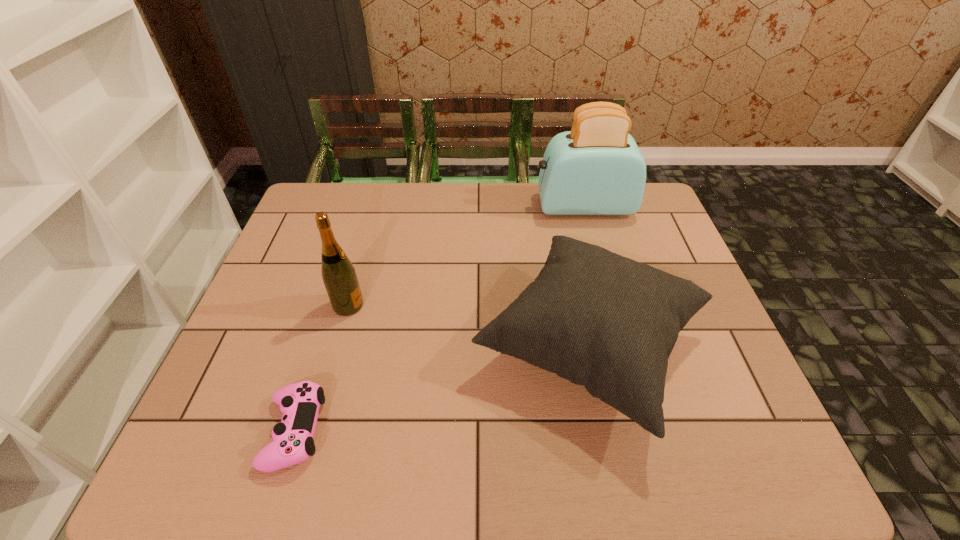
Identify the location of free space at the near edge. The width and height of the screenshot is (960, 540). (383, 455).

In the image, there is a desktop. At what (x,y) coordinates should I click in order to perform the action: click on free space at the left edge. Please return your answer as a coordinate pair (x, y). Looking at the image, I should click on (248, 382).

Locate an element on the screen. free spot at the right edge of the desktop is located at coordinates tap(668, 248).

Find the location of a particular element. Image resolution: width=960 pixels, height=540 pixels. vacant space at the far left corner of the desktop is located at coordinates tap(349, 185).

At what (x,y) coordinates should I click in order to perform the action: click on empty space between the farthest object and the shortest object. Please return your answer as a coordinate pair (x, y). The width and height of the screenshot is (960, 540). Looking at the image, I should click on (439, 319).

You are a GUI agent. You are given a task and a screenshot of the screen. Output one action in this format:
    pyautogui.click(x=<x>, y=<y>)
    Task: Click on the unoccupied area between the wine bottle and the cushion
    This screenshot has height=540, width=960.
    Given the screenshot: What is the action you would take?
    pyautogui.click(x=468, y=326)

You are a GUI agent. You are given a task and a screenshot of the screen. Output one action in this format:
    pyautogui.click(x=<x>, y=<y>)
    Task: Click on the unoccupied position between the cushion and the shortest object
    
    Given the screenshot: What is the action you would take?
    pyautogui.click(x=442, y=389)

Identify the location of free area in between the shortest object and the wine bottle. (322, 368).

Locate an element on the screen. This screenshot has height=540, width=960. free space between the wine bottle and the control is located at coordinates (322, 368).

I want to click on vacant space that is in between the wine bottle and the control, so click(322, 368).